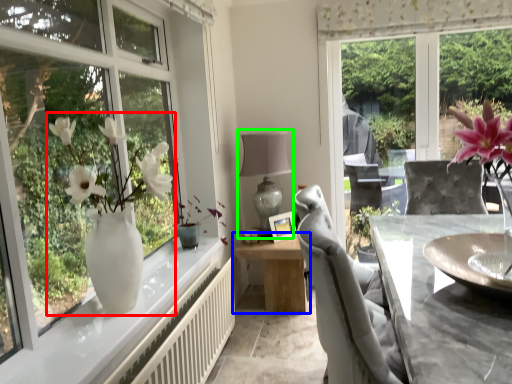
Question: Estimate the real-world distances between objects in this image. Which object is closer to floral arrangement (highlighted by a red box), table (highlighted by a blue box) or table lamp (highlighted by a green box)?

Choices:
 (A) table
 (B) table lamp

Answer: (B)